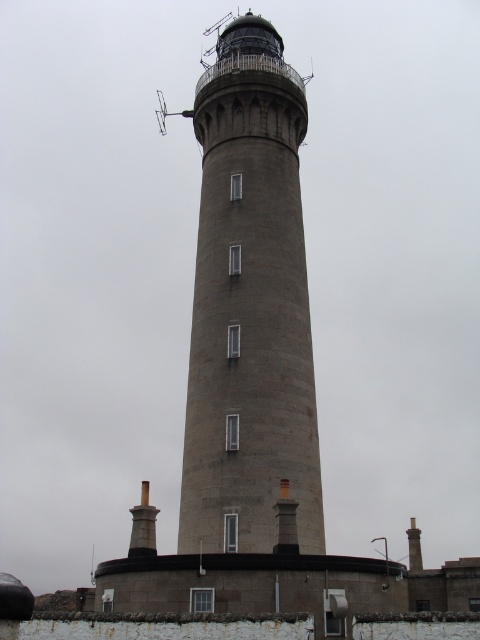
You are a photographer positioned at the base of the lighthouse. You want to capture both point (208, 260) and point (288, 531) in your photo. Which point should you focus on first to ensure both are in sharp focus?

You should focus on point (208, 260) first because it is closer to you than point (288, 531), so focusing on the closer point will help ensure both are in focus.

You are a maintenance worker needing to climb the gray stone tower at center. You notice the dark gray stone chimney at lower right nearby. Which structure is taller so you can decide which requires more climbing effort?

The gray stone tower at center has a smaller size compared to dark gray stone chimney at lower right, so the dark gray stone chimney at lower right is taller and would require more climbing effort.

You are a photographer positioned at the camera location, and you want to capture a closeup shot of the lighthouse. You have a lens that can focus on objects within 40 meters. Is the point at coordinate point (x=156, y=554) within the focus range of your lens?

The distance of point (x=156, y=554) from the camera is 41.13 meters, which is beyond the 40 meters focus range of the lens. Therefore, the point at coordinate point (x=156, y=554) will not be in focus.